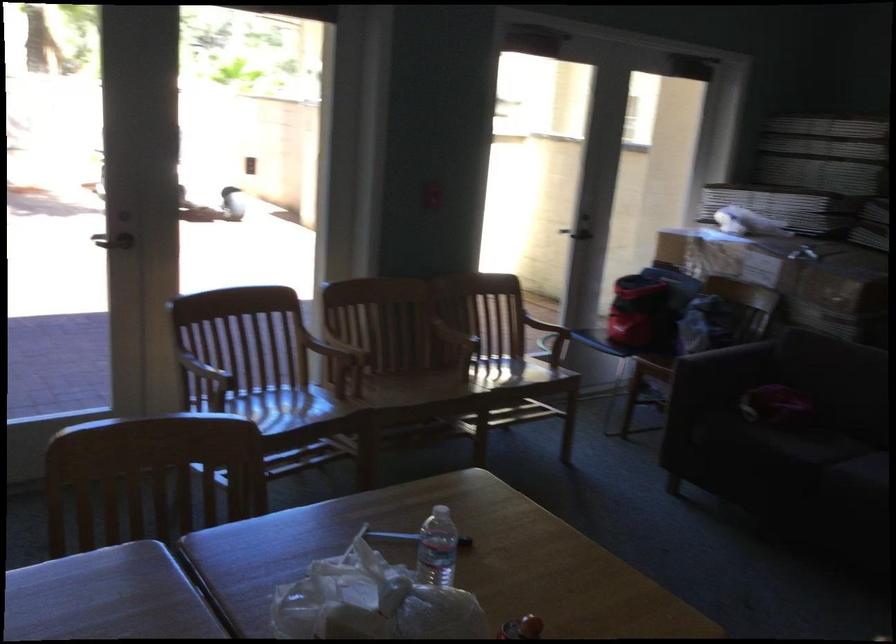
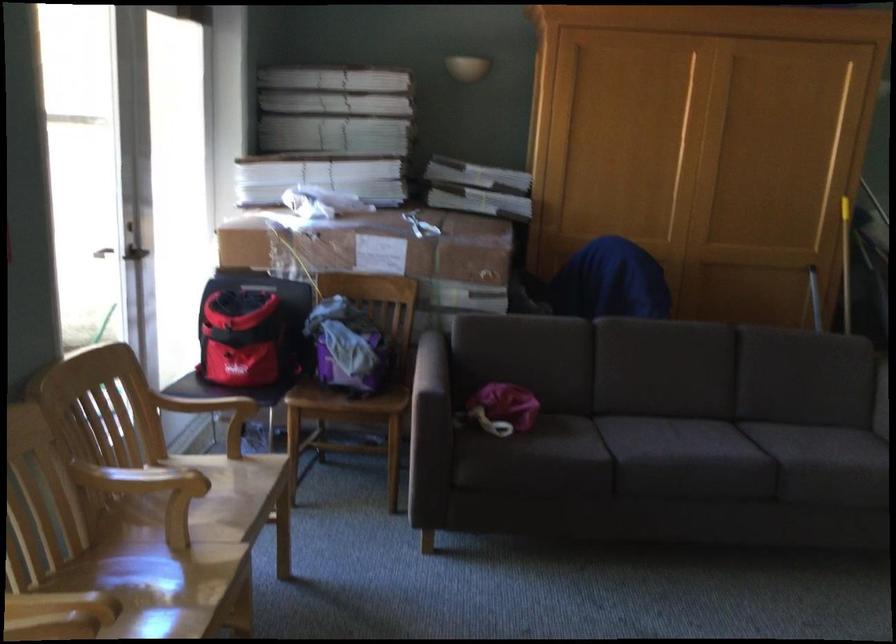
The point at (779, 398) is marked in the first image. Where is the corresponding point in the second image?

(503, 408)